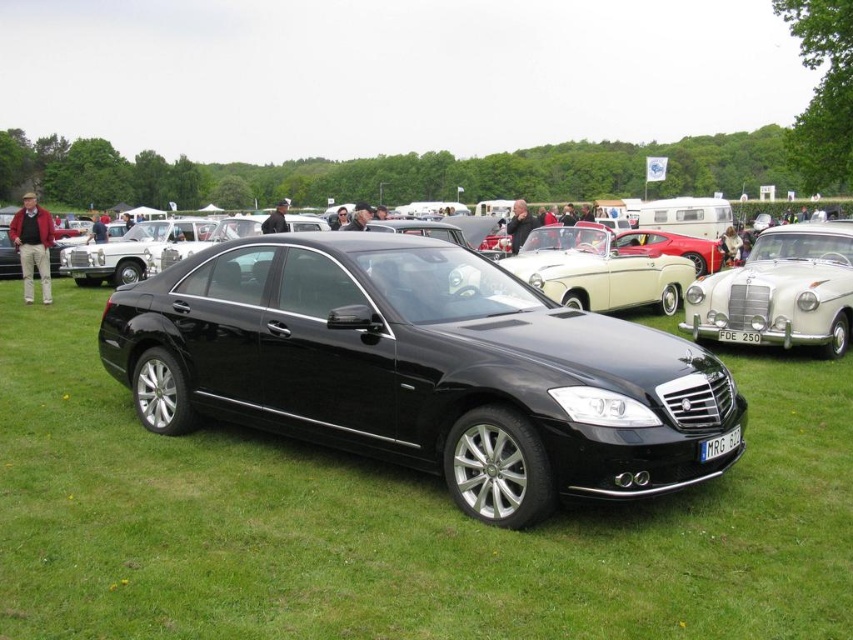
Question: Among these objects, which one is farthest from the camera?

Choices:
 (A) black metallic sedan at center
 (B) silver metallic vintage car at center
 (C) black metallic car at center
 (D) black plastic license plate at center

Answer: (A)

Question: Can you confirm if black metallic sedan at center is positioned to the left of black plastic license plate at center?

Choices:
 (A) no
 (B) yes

Answer: (A)

Question: Which point is farther to the camera?

Choices:
 (A) (728, 449)
 (B) (357, 352)
 (C) (602, 250)

Answer: (C)

Question: Can you confirm if black metallic car at center is positioned above white plastic license plate at center?

Choices:
 (A) no
 (B) yes

Answer: (B)

Question: Is the position of black metallic car at center less distant than that of white plastic license plate at center?

Choices:
 (A) no
 (B) yes

Answer: (B)

Question: Which is farther from the silver metallic vintage car at center?

Choices:
 (A) black metallic car at center
 (B) white plastic license plate at center
 (C) black metallic sedan at center
 (D) black plastic license plate at center

Answer: (A)